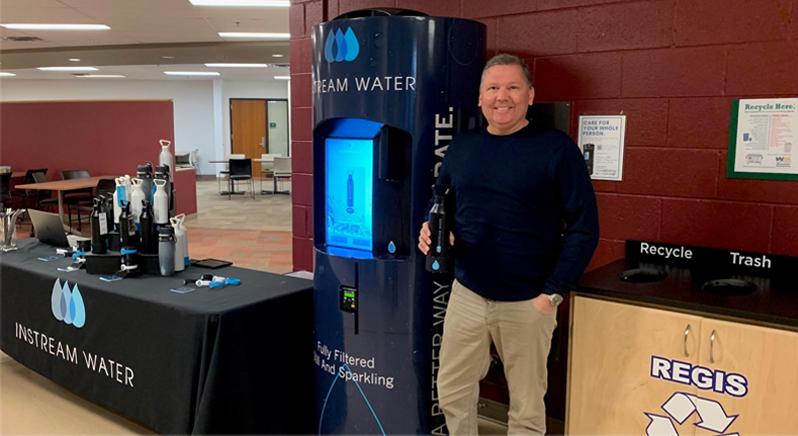
The width and height of the screenshot is (798, 436). What are the coordinates of `ceiling` in the screenshot? It's located at (144, 71).